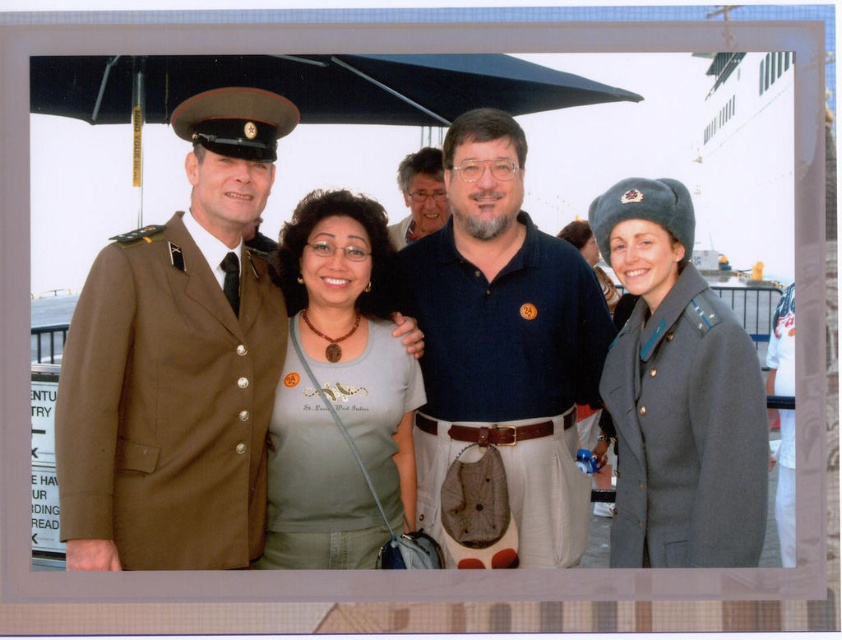
Question: Considering the real-world distances, which object is closest to the black matte canopy at upper center?

Choices:
 (A) brown woolen uniform at left
 (B) matte black shirt at center
 (C) white cotton shirt at center
 (D) blue cotton polo shirt at center

Answer: (B)

Question: Which point is closer to the camera?

Choices:
 (A) brown woolen uniform at left
 (B) matte brown uniform at left
 (C) black matte canopy at upper center

Answer: (C)

Question: Is black matte canopy at upper center thinner than matte black shirt at center?

Choices:
 (A) no
 (B) yes

Answer: (A)

Question: Can you confirm if blue cotton polo shirt at center is positioned above black matte canopy at upper center?

Choices:
 (A) no
 (B) yes

Answer: (A)

Question: From the image, what is the correct spatial relationship of matte gray shirt at center in relation to gray woolen coat at right?

Choices:
 (A) right
 (B) left

Answer: (B)

Question: Which point appears farthest from the camera in this image?

Choices:
 (A) (352, 432)
 (B) (525, 292)
 (C) (384, 115)

Answer: (C)